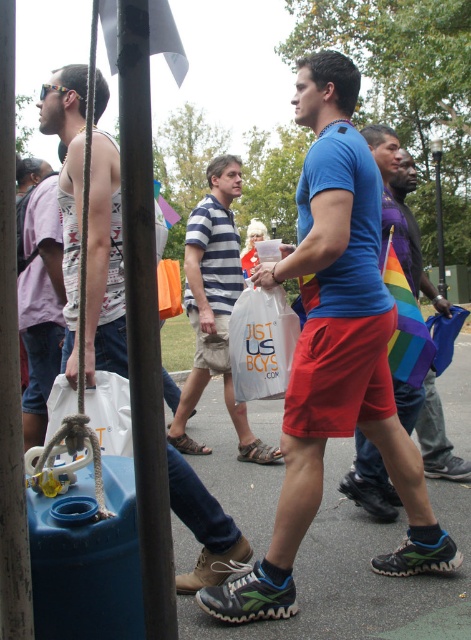
Question: Among these objects, which one is nearest to the camera?

Choices:
 (A) blue matte t-shirt at center
 (B) brushed metal pole at left
 (C) striped cotton shirt at center

Answer: (B)

Question: Which of these objects is positioned closest to the matte white tank top at left?

Choices:
 (A) light purple cotton shirt at left
 (B) striped cotton shirt at center
 (C) blue matte t-shirt at center
 (D) matte blue t-shirt at center

Answer: (A)

Question: Can you confirm if brushed metal pole at left is smaller than light purple cotton shirt at left?

Choices:
 (A) yes
 (B) no

Answer: (A)

Question: Is blue matte t-shirt at center bigger than light purple cotton shirt at left?

Choices:
 (A) no
 (B) yes

Answer: (B)

Question: Is blue matte t-shirt at center bigger than striped cotton shirt at center?

Choices:
 (A) yes
 (B) no

Answer: (B)

Question: Which point appears closest to the camera in this image?

Choices:
 (A) (3, 225)
 (B) (192, 250)

Answer: (A)